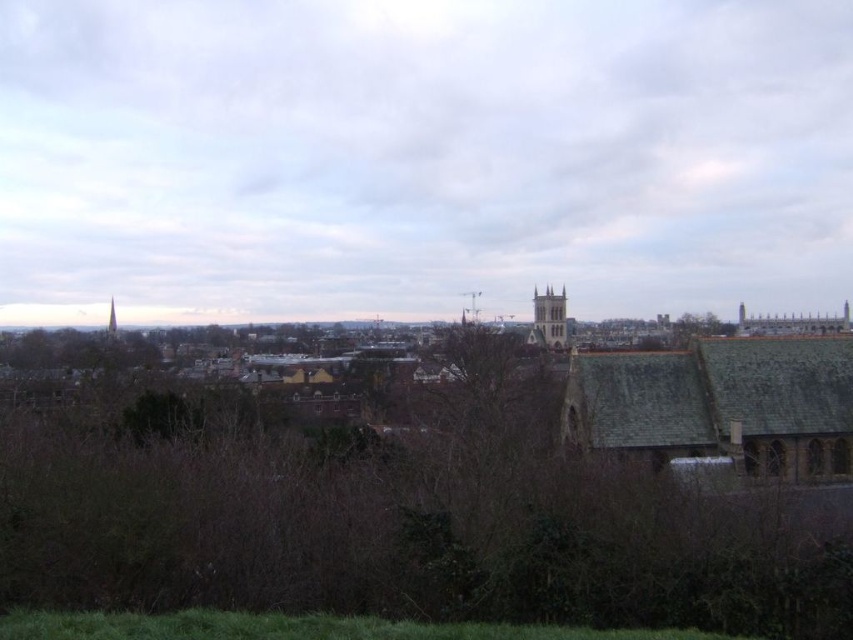
Consider the image. You are standing at the center of the city park and want to take a photo of the light brown stone tower at center. Which direction should you face to ensure the tower is in the center of your photo?

The light brown stone tower at center is located at point (549, 317), so you should face towards the center of the scene to capture it in the photo.